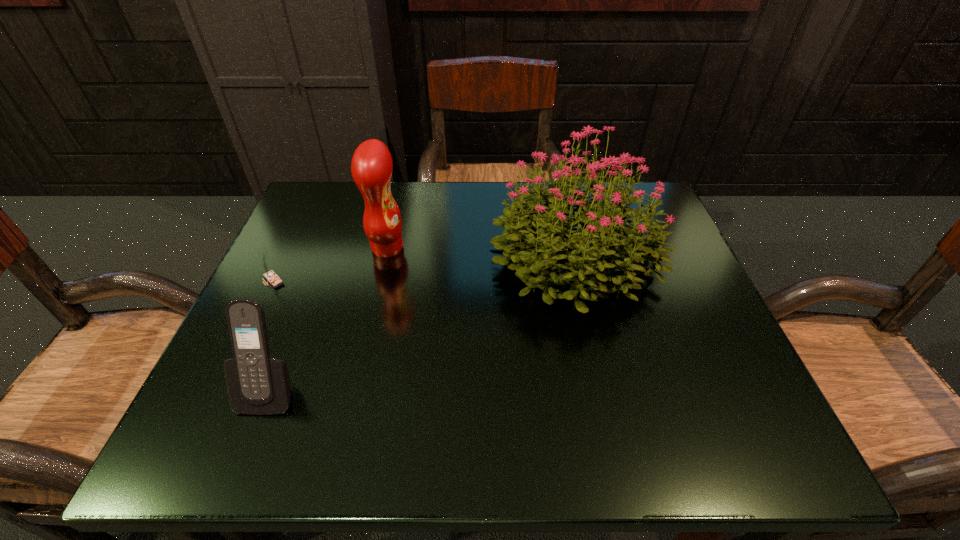
Where is `free space located 0.060m on the front-facing side of the cellular telephone`? free space located 0.060m on the front-facing side of the cellular telephone is located at coordinates (247, 453).

The width and height of the screenshot is (960, 540). I want to click on free space located on the front of the leftmost object, so click(206, 421).

At what (x,y) coordinates should I click in order to perform the action: click on bouquet that is positioned at the far edge. Please return your answer as a coordinate pair (x, y). Looking at the image, I should click on (536, 239).

Locate an element on the screen. condiment that is at the far edge is located at coordinates (371, 167).

Find the location of a particular element. object situated at the near edge is located at coordinates (257, 384).

You are a GUI agent. You are given a task and a screenshot of the screen. Output one action in this format:
    pyautogui.click(x=<x>, y=<y>)
    Task: Click on the cellular telephone at the left edge
    The width and height of the screenshot is (960, 540).
    Given the screenshot: What is the action you would take?
    pyautogui.click(x=257, y=384)

You are a GUI agent. You are given a task and a screenshot of the screen. Output one action in this format:
    pyautogui.click(x=<x>, y=<y>)
    Task: Click on the matchbox that is at the left edge
    
    Given the screenshot: What is the action you would take?
    pyautogui.click(x=269, y=275)

Find the location of a particular element. This screenshot has height=540, width=960. object situated at the right edge is located at coordinates (536, 239).

The image size is (960, 540). I want to click on object present at the near left corner, so click(257, 384).

I want to click on object located at the far right corner, so click(x=536, y=239).